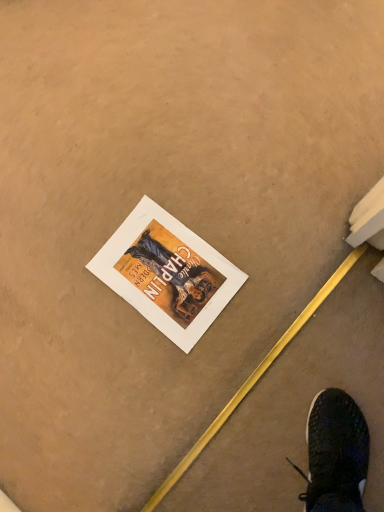
At what (x,y) coordinates should I click in order to perform the action: click on empty space that is ontop of matte paper poster at center (from a real-world perspective). Please return your answer as a coordinate pair (x, y). This screenshot has height=512, width=384. Looking at the image, I should click on (151, 268).